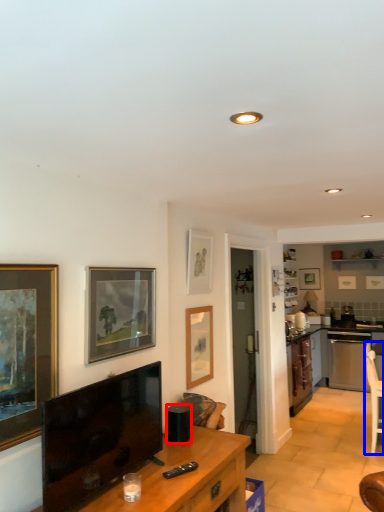
Question: Which point is closer to the camera, appliance (highlighted by a red box) or chair (highlighted by a blue box)?

Choices:
 (A) appliance
 (B) chair

Answer: (A)